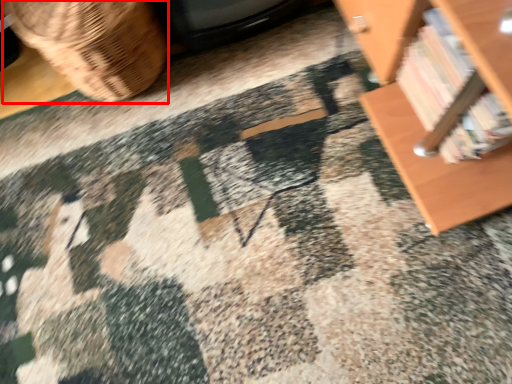
Question: From the image's perspective, what is the correct spatial relationship of basket (annotated by the red box) in relation to book?

Choices:
 (A) above
 (B) below

Answer: (A)